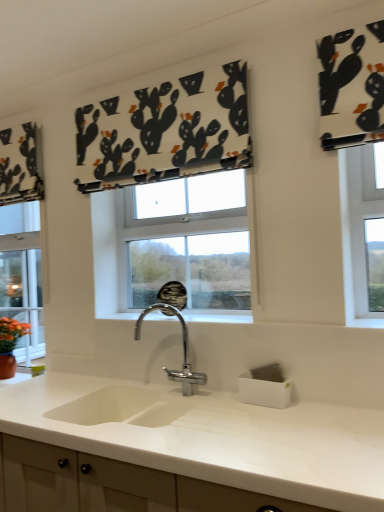
What is the approximate width of chrome metallic faucet at center?

21.80 centimeters.

In order to face black printed fabric at upper center, should I rotate leftwards or rightwards?

Turn left approximately 5.782 degrees to face it.

Find the location of `chrome metallic faucet at center`. chrome metallic faucet at center is located at coordinates (183, 350).

Does white matte countertop at center have a greater height compared to chrome metallic faucet at center?

Yes.

Which object is positioned more to the right, white matte countertop at center or chrome metallic faucet at center?

Positioned to the right is chrome metallic faucet at center.

How different are the orientations of chrome metallic faucet at center and white matte countertop at center in degrees?

The angle between the facing direction of chrome metallic faucet at center and the facing direction of white matte countertop at center is 2.8 degrees.

From the image's perspective, is chrome metallic faucet at center above or below white matte countertop at center?

chrome metallic faucet at center is situated higher than white matte countertop at center in the image.

From a real-world perspective, which is physically above, chrome metallic faucet at center or white matte countertop at center?

chrome metallic faucet at center is physically above.

Does chrome metallic faucet at center have a smaller size compared to white matte countertop at center?

Yes, chrome metallic faucet at center is smaller than white matte countertop at center.

Considering the sizes of black printed fabric at upper center and chrome metallic faucet at center in the image, is black printed fabric at upper center bigger or smaller than chrome metallic faucet at center?

In the image, black printed fabric at upper center appears to be larger than chrome metallic faucet at center.

Is chrome metallic faucet at center inside black printed fabric at upper center?

No, black printed fabric at upper center does not contain chrome metallic faucet at center.

Is black printed fabric at upper center positioned with its back to chrome metallic faucet at center?

No, black printed fabric at upper center is not facing away from chrome metallic faucet at center.

Which of these two, black printed fabric at upper center or chrome metallic faucet at center, stands taller?

black printed fabric at upper center.

Considering the relative positions of black printed fabric at upper center and white matte countertop at center in the image provided, is black printed fabric at upper center to the right of white matte countertop at center from the viewer's perspective?

No, black printed fabric at upper center is not to the right of white matte countertop at center.

Is the position of black printed fabric at upper center less distant than that of white matte countertop at center?

No, the depth of black printed fabric at upper center is greater than that of white matte countertop at center.

Who is bigger, black printed fabric at upper center or white matte countertop at center?

Bigger between the two is white matte countertop at center.

From a real-world perspective, is black printed fabric at upper center physically below white matte countertop at center?

Incorrect, from a real-world perspective, black printed fabric at upper center is higher than white matte countertop at center.

Could black printed fabric at upper center be considered to be inside white matte countertop at center?

Actually, black printed fabric at upper center is outside white matte countertop at center.

Who is taller, white matte countertop at center or black printed fabric at upper center?

white matte countertop at center is taller.

Looking at their sizes, would you say white matte countertop at center is wider or thinner than black printed fabric at upper center?

Clearly, white matte countertop at center has more width compared to black printed fabric at upper center.

From a real-world perspective, does white matte countertop at center sit lower than black printed fabric at upper center?

→ Indeed, from a real-world perspective, white matte countertop at center is positioned beneath black printed fabric at upper center.

Where is `curtain located above the chrome metallic faucet at center (from the image's perspective)`? curtain located above the chrome metallic faucet at center (from the image's perspective) is located at coordinates (165, 131).

From the image's perspective, is chrome metallic faucet at center below black printed fabric at upper center?

Yes, from the image's perspective, chrome metallic faucet at center is beneath black printed fabric at upper center.

Does chrome metallic faucet at center touch black printed fabric at upper center?

chrome metallic faucet at center is not next to black printed fabric at upper center, and they're not touching.

Is chrome metallic faucet at center smaller than black printed fabric at upper center?

Indeed, chrome metallic faucet at center has a smaller size compared to black printed fabric at upper center.

In the image, there is a chrome metallic faucet at center. Identify the location of countertop below it (from the image's perspective). This screenshot has height=512, width=384. (209, 436).

Identify the location of tap above the white matte countertop at center (from the image's perspective). This screenshot has width=384, height=512. (183, 350).

From the image, which object appears to be farther from white matte countertop at center, black printed fabric at upper center or chrome metallic faucet at center?

The object further to white matte countertop at center is black printed fabric at upper center.

Based on the photo, which object lies further to the anchor point chrome metallic faucet at center, black printed fabric at upper center or white matte countertop at center?

black printed fabric at upper center.

In the scene shown: Based on their spatial positions, is white matte countertop at center or black printed fabric at upper center further from chrome metallic faucet at center?

Among the two, black printed fabric at upper center is located further to chrome metallic faucet at center.

When comparing their distances from black printed fabric at upper center, does white matte countertop at center or chrome metallic faucet at center seem further?

white matte countertop at center.

Looking at the image, which one is located further to white matte countertop at center, chrome metallic faucet at center or black printed fabric at upper center?

black printed fabric at upper center lies further to white matte countertop at center than the other object.

From the image, which object appears to be farther from black printed fabric at upper center, chrome metallic faucet at center or white matte countertop at center?

white matte countertop at center is further to black printed fabric at upper center.

This screenshot has width=384, height=512. Find the location of `tap between black printed fabric at upper center and white matte countertop at center in the up-down direction`. tap between black printed fabric at upper center and white matte countertop at center in the up-down direction is located at coordinates (183, 350).